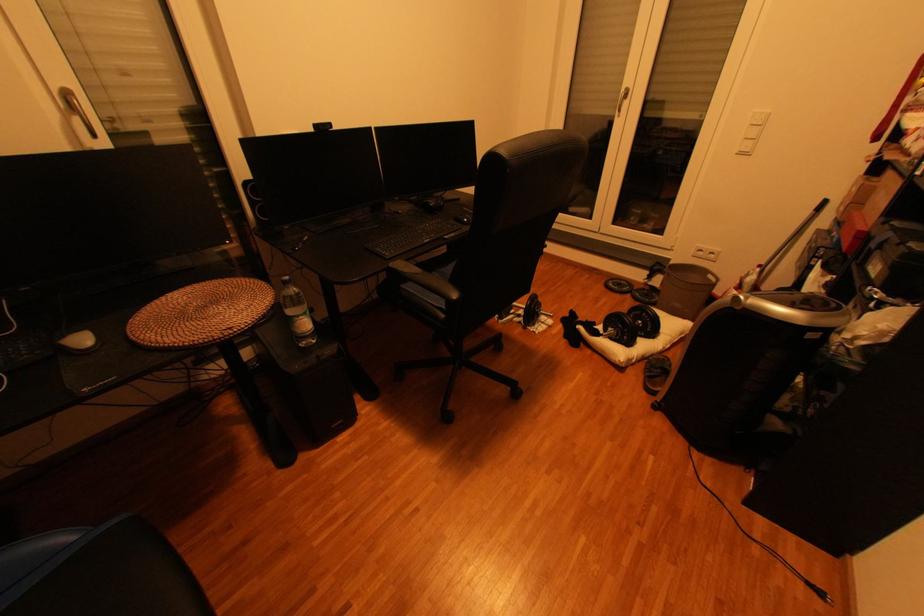
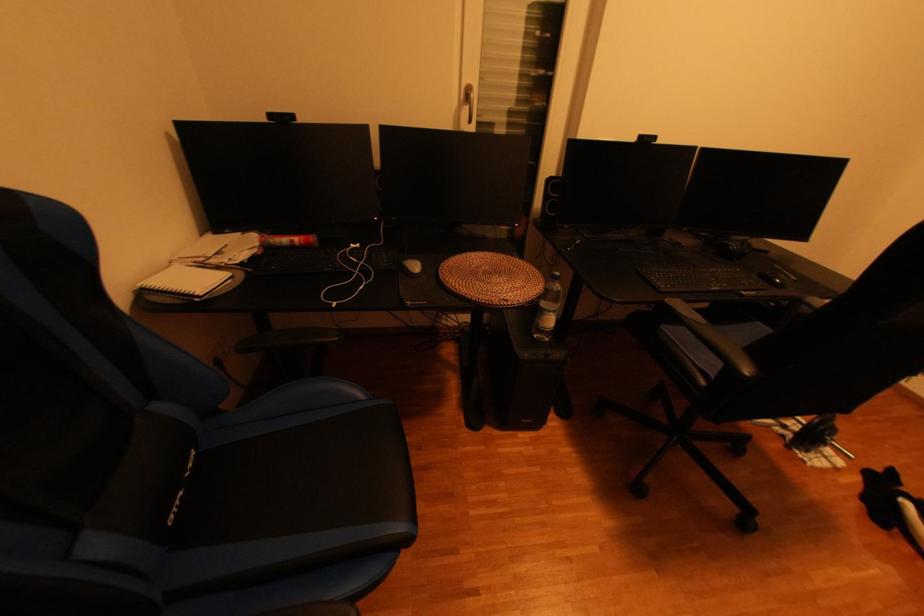
In the second image, find the point that corresponds to the point at 239,333 in the first image.

(515, 304)